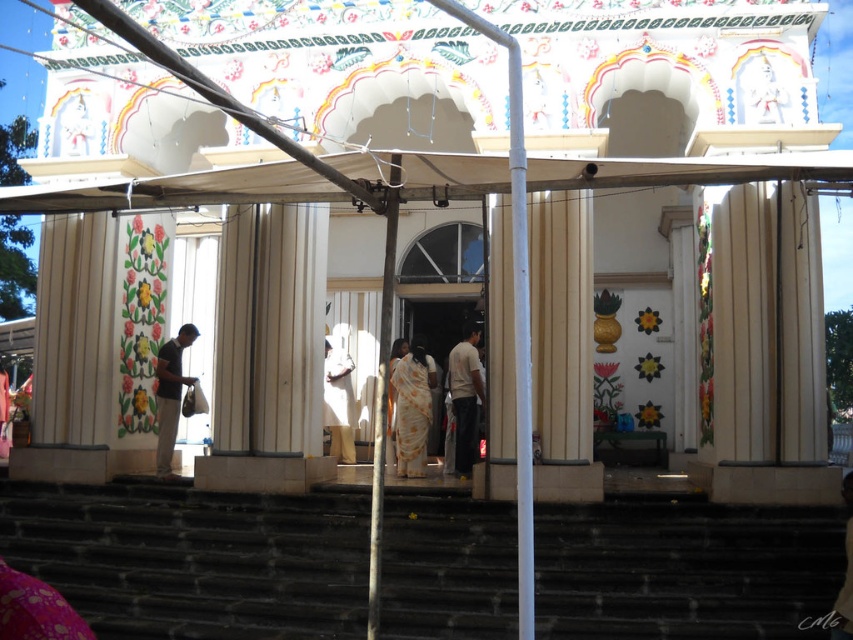
Question: Can you confirm if white cotton shirt at center is positioned to the right of matte black shirt at left?

Choices:
 (A) yes
 (B) no

Answer: (A)

Question: Which point is farther to the camera?

Choices:
 (A) (434, 392)
 (B) (15, 528)
 (C) (408, 476)

Answer: (A)

Question: Observing the image, what is the correct spatial positioning of dark stone stairs at lower center in reference to white cotton shirt at center?

Choices:
 (A) below
 (B) above

Answer: (A)

Question: Is white fabric door at center bigger than white cotton shirt at center?

Choices:
 (A) no
 (B) yes

Answer: (B)

Question: Which of the following is the farthest from the observer?

Choices:
 (A) matte black shirt at left
 (B) dark stone stairs at lower center
 (C) white fabric door at center
 (D) white cotton shirt at center

Answer: (C)

Question: Which of the following is the farthest from the observer?

Choices:
 (A) [421, 445]
 (B) [183, 378]

Answer: (B)